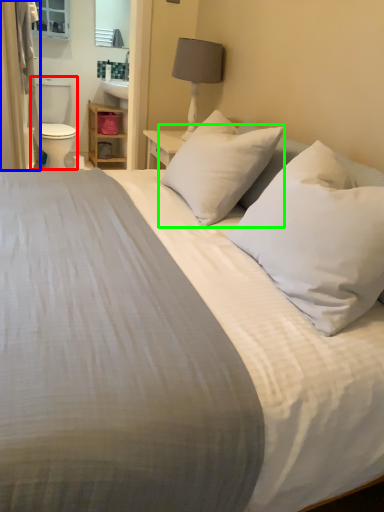
Question: Based on their relative distances, which object is nearer to toilet bowl (highlighted by a red box)? Choose from curtain (highlighted by a blue box) and pillow (highlighted by a green box).

Choices:
 (A) curtain
 (B) pillow

Answer: (A)